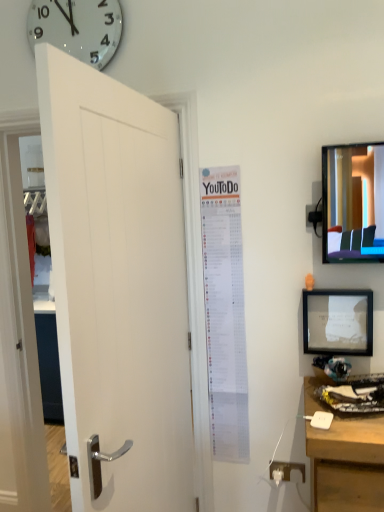
Question: Is matte black picture frame at right thinner than white glossy clock at upper left?

Choices:
 (A) yes
 (B) no

Answer: (B)

Question: Can you confirm if matte black picture frame at right is positioned to the right of white glossy clock at upper left?

Choices:
 (A) no
 (B) yes

Answer: (B)

Question: Is matte black picture frame at right directly adjacent to white glossy clock at upper left?

Choices:
 (A) no
 (B) yes

Answer: (A)

Question: From a real-world perspective, is matte black picture frame at right under white glossy clock at upper left?

Choices:
 (A) yes
 (B) no

Answer: (A)

Question: Considering the relative positions of matte black picture frame at right and white glossy clock at upper left in the image provided, is matte black picture frame at right to the left of white glossy clock at upper left from the viewer's perspective?

Choices:
 (A) yes
 (B) no

Answer: (B)

Question: Would you consider matte black picture frame at right to be distant from white glossy clock at upper left?

Choices:
 (A) yes
 (B) no

Answer: (A)

Question: Are matte black picture frame at right and white wooden door at left far apart?

Choices:
 (A) no
 (B) yes

Answer: (A)

Question: From a real-world perspective, is matte black picture frame at right positioned under white wooden door at left based on gravity?

Choices:
 (A) yes
 (B) no

Answer: (B)

Question: Is matte black picture frame at right to the right of white wooden door at left from the viewer's perspective?

Choices:
 (A) no
 (B) yes

Answer: (B)

Question: From the image's perspective, does matte black picture frame at right appear higher than white wooden door at left?

Choices:
 (A) no
 (B) yes

Answer: (B)

Question: Can you see matte black picture frame at right touching white wooden door at left?

Choices:
 (A) yes
 (B) no

Answer: (B)

Question: Is matte black picture frame at right looking in the opposite direction of white wooden door at left?

Choices:
 (A) no
 (B) yes

Answer: (A)

Question: From the image's perspective, is white wooden door at left under white plastic outlet at lower right?

Choices:
 (A) yes
 (B) no

Answer: (B)